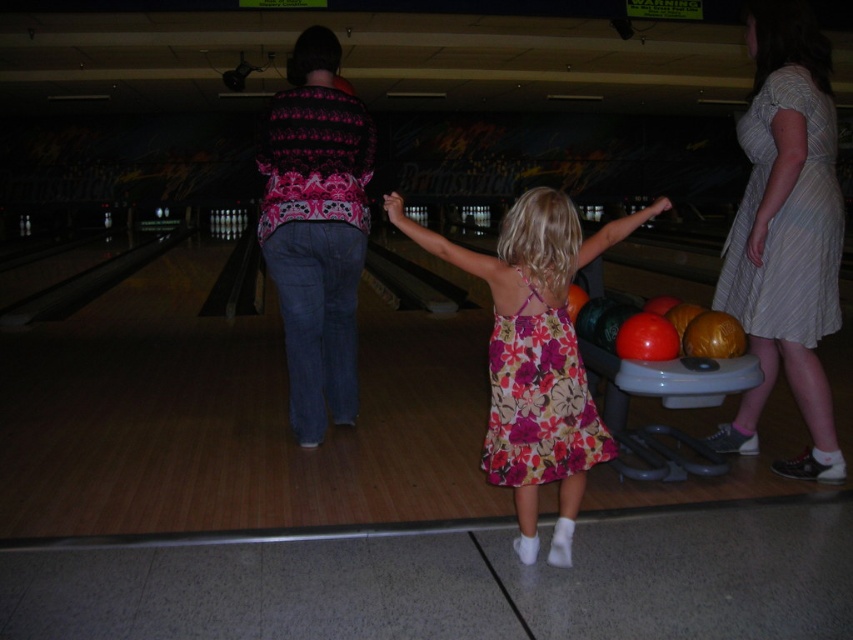
Based on the photo, based on the scene description, what are the coordinates of the floral dress at center?

The floral dress at center is located at coordinates point (535, 355).

You are standing at the camera position and want to move towards the two points in the image. Which point, point (583, 385) or point (787, 90), will you reach first?

Point (583, 385) is closer to the camera than point (787, 90), so you will reach point (583, 385) first.

You are a photographer at the bowling alley and need to capture a photo of the floral dress at center and the floral print fabric dress at center. Which dress should you focus on to ensure it appears taller in the photo?

The floral dress at center should be focused on because it has a greater height compared to the floral print fabric dress at center, making it appear taller in the photo.